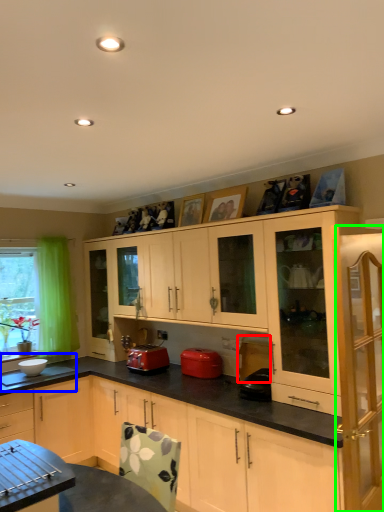
Question: Which object is positioned farthest from appliance (highlighted by a red box)? Select from sink (highlighted by a blue box) and cabinetry (highlighted by a green box).

Choices:
 (A) sink
 (B) cabinetry

Answer: (A)